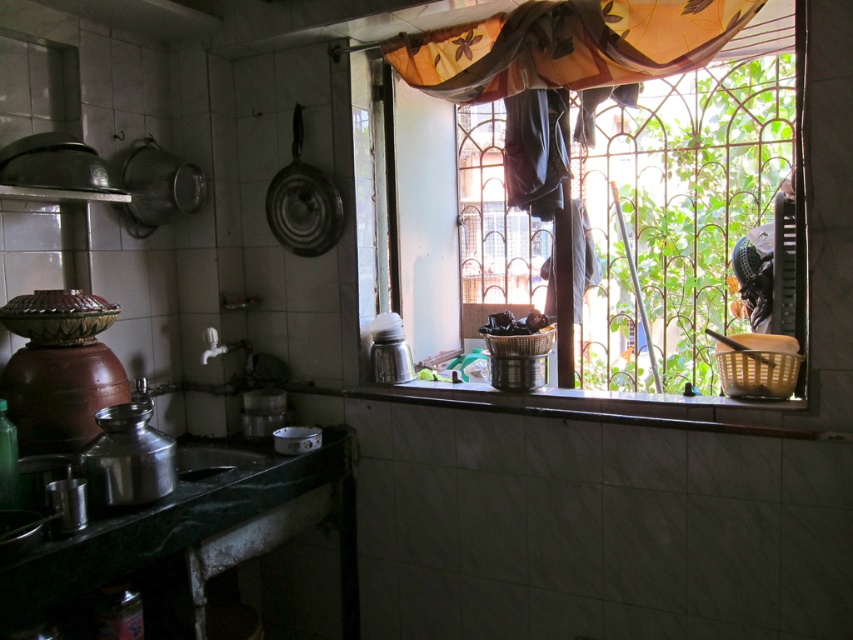
Describe the element at coordinates (682, 218) in the screenshot. The image size is (853, 640). I see `translucent fabric at upper right` at that location.

Is translucent fabric at upper right wider than translucent floral-patterned curtain at upper center?

Indeed, translucent fabric at upper right has a greater width compared to translucent floral-patterned curtain at upper center.

Who is more distant from viewer, (729, 308) or (692, 42)?

The point (729, 308) is behind.

Locate an element on the screen. The width and height of the screenshot is (853, 640). translucent fabric at upper right is located at coordinates (682, 218).

Looking at this image, who is positioned more to the left, translucent floral-patterned curtain at upper center or metallic sink at lower left?

From the viewer's perspective, metallic sink at lower left appears more on the left side.

Is point (550, 54) closer to camera compared to point (199, 460)?

Yes, it is.

Does point (656, 22) lie in front of point (236, 454)?

Yes, it is.

This screenshot has height=640, width=853. Find the location of `translucent floral-patterned curtain at upper center`. translucent floral-patterned curtain at upper center is located at coordinates (566, 45).

Which is behind, point (650, 156) or point (180, 448)?

The point (650, 156) is behind.

Is point (776, 275) in front of point (200, 445)?

Yes, point (776, 275) is in front of point (200, 445).

Who is more forward, (669, 164) or (183, 470)?

Positioned in front is point (183, 470).

Image resolution: width=853 pixels, height=640 pixels. Identify the location of translucent fabric at upper right. (682, 218).